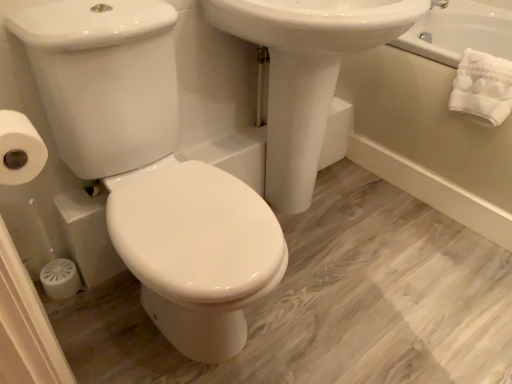
Question: In the image, is white soft towel at upper right positioned in front of or behind white matte toilet paper at left?

Choices:
 (A) front
 (B) behind

Answer: (B)

Question: Looking at the image, does white soft towel at upper right seem bigger or smaller compared to white matte toilet paper at left?

Choices:
 (A) small
 (B) big

Answer: (B)

Question: Based on their relative distances, which object is farther from the white soft towel at upper right?

Choices:
 (A) white glossy bathtub at upper right
 (B) white matte toilet paper at left
 (C) white glossy porcelain at center
 (D) white glossy sink at center

Answer: (B)

Question: Considering the real-world distances, which object is closest to the white glossy sink at center?

Choices:
 (A) white matte toilet paper at left
 (B) white soft towel at upper right
 (C) white glossy bathtub at upper right
 (D) white glossy porcelain at center

Answer: (D)